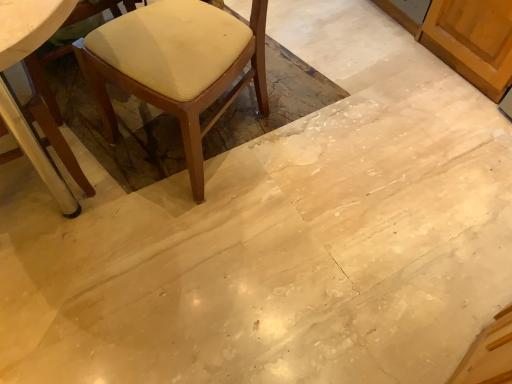
Question: From the image's perspective, is matte beige cushioned chair at left, the second chair positioned from the left, located above or below wooden chair at left, the 1th chair when ordered from left to right?

Choices:
 (A) above
 (B) below

Answer: (A)

Question: Considering the positions of matte beige cushioned chair at left, arranged as the first chair when viewed from the right, and wooden chair at left, the 1th chair when ordered from left to right, in the image, is matte beige cushioned chair at left, arranged as the first chair when viewed from the right, wider or thinner than wooden chair at left, the 1th chair when ordered from left to right,?

Choices:
 (A) wide
 (B) thin

Answer: (A)

Question: From their relative heights in the image, would you say matte beige cushioned chair at left, the second chair positioned from the left, is taller or shorter than wooden chair at left, the 1th chair when ordered from left to right?

Choices:
 (A) short
 (B) tall

Answer: (B)

Question: From a real-world perspective, is wooden chair at left, the 1th chair when ordered from left to right, above or below matte beige cushioned chair at left, the second chair positioned from the left?

Choices:
 (A) above
 (B) below

Answer: (B)

Question: Looking at the image, does wooden chair at left, the 1th chair when ordered from left to right, seem bigger or smaller compared to matte beige cushioned chair at left, arranged as the first chair when viewed from the right?

Choices:
 (A) small
 (B) big

Answer: (A)

Question: From the image's perspective, is wooden chair at left, which is the 2th chair in right-to-left order, located above or below matte beige cushioned chair at left, arranged as the first chair when viewed from the right?

Choices:
 (A) above
 (B) below

Answer: (B)

Question: Relative to matte beige cushioned chair at left, the second chair positioned from the left, is wooden chair at left, which is the 2th chair in right-to-left order, in front or behind?

Choices:
 (A) front
 (B) behind

Answer: (A)